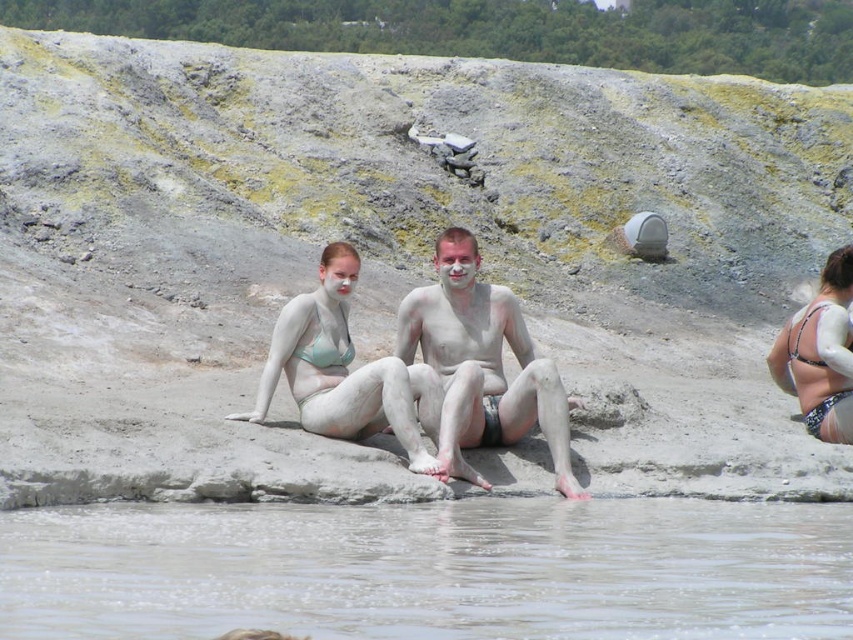
Question: Is white matte skin at center smaller than matte clay bikini at center?

Choices:
 (A) no
 (B) yes

Answer: (A)

Question: Which of these objects is positioned closest to the matte clay bikini at center?

Choices:
 (A) white matte skin at center
 (B) clear mud at water center
 (C) white matte bikini bottom at lower right

Answer: (A)

Question: Does clear mud at water center come behind white matte skin at center?

Choices:
 (A) yes
 (B) no

Answer: (B)

Question: Is matte clay bikini at center below white matte bikini bottom at lower right?

Choices:
 (A) yes
 (B) no

Answer: (A)

Question: Which of these objects is positioned closest to the white matte bikini bottom at lower right?

Choices:
 (A) clear mud at water center
 (B) matte clay bikini at center

Answer: (B)

Question: Which point is farther to the camera?

Choices:
 (A) (639, 516)
 (B) (386, 419)

Answer: (B)